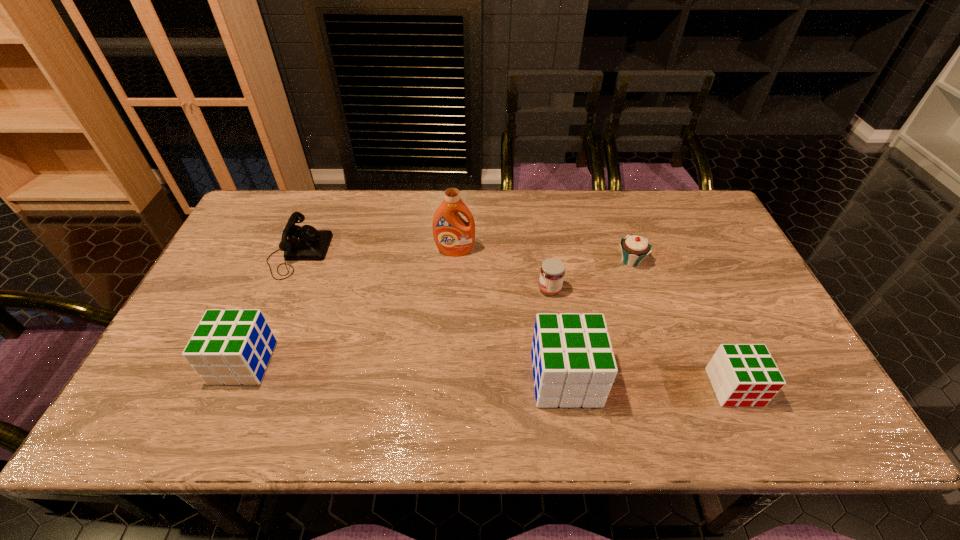
Find the location of a particular element. The width and height of the screenshot is (960, 540). the fourth farthest object is located at coordinates (552, 271).

Where is `vacant position located on the red face of the second shortest cube`? Image resolution: width=960 pixels, height=540 pixels. vacant position located on the red face of the second shortest cube is located at coordinates (192, 362).

You are a GUI agent. You are given a task and a screenshot of the screen. Output one action in this format:
    pyautogui.click(x=<x>, y=<y>)
    Task: Click on the free space located on the red face of the second shortest cube
    Image resolution: width=960 pixels, height=540 pixels.
    Given the screenshot: What is the action you would take?
    pyautogui.click(x=172, y=362)

In order to click on vacant space located on the red face of the second shortest cube in this screenshot , I will do `click(180, 362)`.

Identify the location of free location located 0.330m on the red face of the second cube from right to left. The image size is (960, 540). (739, 379).

Locate an element on the screen. blank space located 0.250m on the front face of the telephone is located at coordinates (410, 253).

Locate an element on the screen. vacant space located 0.060m on the back of the second object from right to left is located at coordinates (623, 238).

Identify the location of vacant space situated 0.120m on the front-facing side of the third object from left to right. (453, 286).

Find the location of a particular element. vacant area situated 0.080m on the back of the jam is located at coordinates (545, 261).

This screenshot has height=540, width=960. I want to click on object that is at the far edge, so click(305, 243).